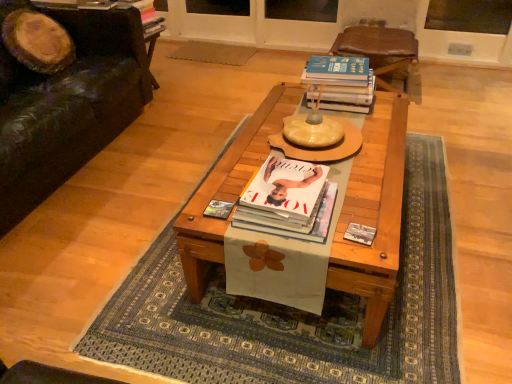
Where is `vacant region to the left of matte yellow round table at center`? vacant region to the left of matte yellow round table at center is located at coordinates (246, 151).